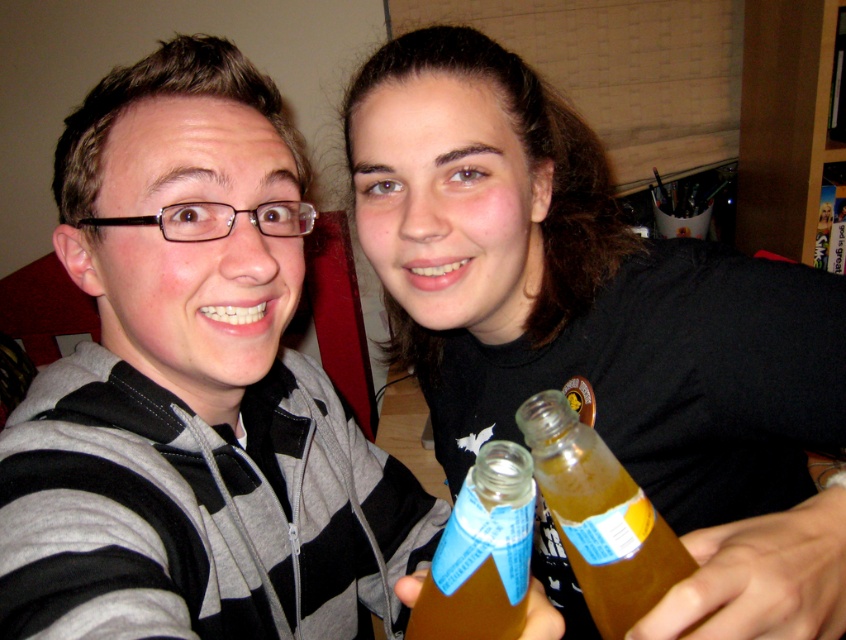
Is gray striped hoodie at center taller than black matte bottle at center?

No.

Where is `gray striped hoodie at center`? This screenshot has height=640, width=846. gray striped hoodie at center is located at coordinates (194, 388).

Between point (28, 502) and point (355, 124), which one is positioned behind?

The point (355, 124) is more distant.

Locate an element on the screen. The height and width of the screenshot is (640, 846). gray striped hoodie at center is located at coordinates (194, 388).

Between gray striped hoodie at center and translucent plastic bottle at lower center, which one appears on the right side from the viewer's perspective?

translucent plastic bottle at lower center is more to the right.

Where is `gray striped hoodie at center`? gray striped hoodie at center is located at coordinates (194, 388).

Does black matte bottle at center have a greater height compared to translucent plastic bottle at lower center?

Correct, black matte bottle at center is much taller as translucent plastic bottle at lower center.

Is point (509, 321) farther from viewer compared to point (509, 561)?

Yes, it is behind point (509, 561).

Image resolution: width=846 pixels, height=640 pixels. I want to click on black matte bottle at center, so click(602, 324).